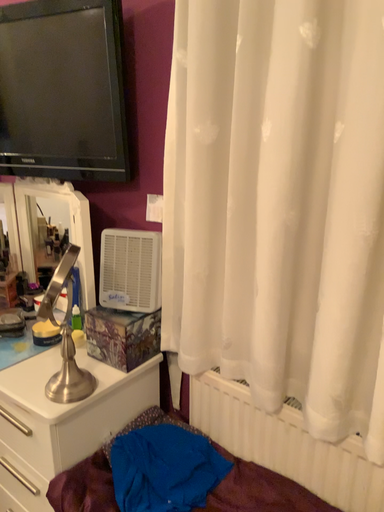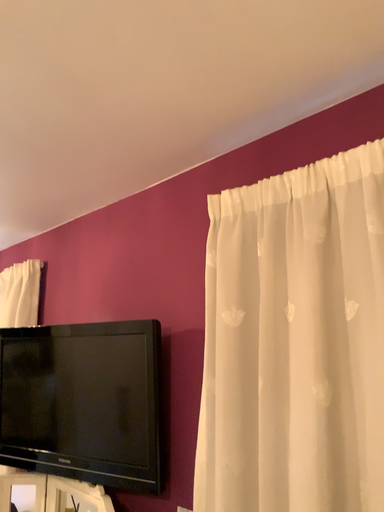
Question: Which way did the camera rotate in the video?

Choices:
 (A) rotated upward
 (B) rotated downward

Answer: (A)